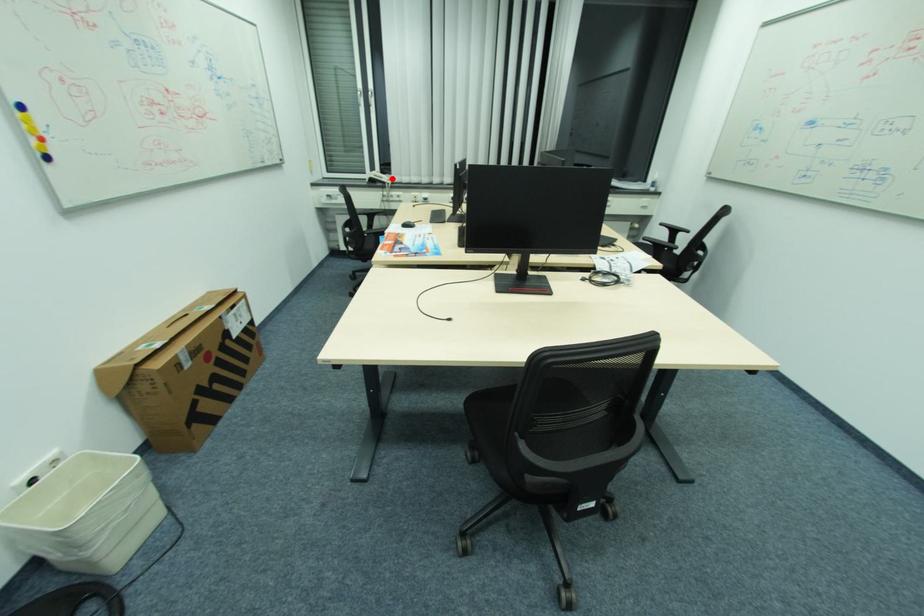
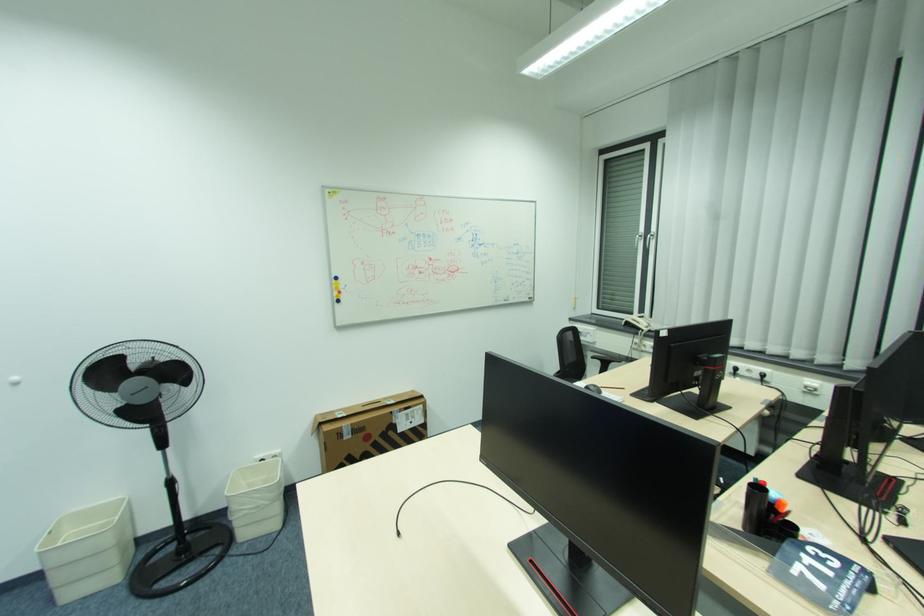
Find the pixel in the second image that matches the highlighted location in the first image.

(650, 325)